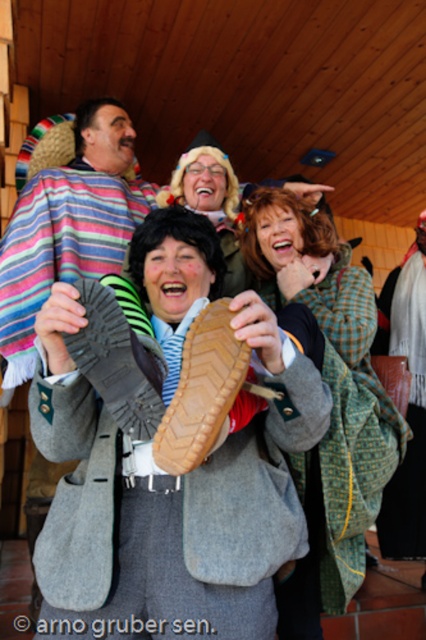
Does green plaid coat at center have a lesser width compared to rubber/textured shoe at center?

No, green plaid coat at center is not thinner than rubber/textured shoe at center.

Between point (386, 452) and point (83, 336), which one is positioned in front?

Point (83, 336) is in front.

At what (x,y) coordinates should I click in order to perform the action: click on green plaid coat at center. Please return your answer as a coordinate pair (x, y). The image size is (426, 640). Looking at the image, I should click on (333, 401).

Locate an element on the screen. Image resolution: width=426 pixels, height=640 pixels. green plaid coat at center is located at coordinates (333, 401).

Does brown leather shoe at center have a larger size compared to rubber/textured shoe at center?

Actually, brown leather shoe at center might be smaller than rubber/textured shoe at center.

Who is positioned more to the right, brown leather shoe at center or rubber/textured shoe at center?

Positioned to the right is brown leather shoe at center.

The height and width of the screenshot is (640, 426). Find the location of `brown leather shoe at center`. brown leather shoe at center is located at coordinates (201, 390).

The height and width of the screenshot is (640, 426). In order to click on brown leather shoe at center in this screenshot , I will do `click(201, 390)`.

Is green plaid coat at center below brown leather shoe at center?

Yes, green plaid coat at center is below brown leather shoe at center.

Which is behind, point (330, 276) or point (207, 349)?

The point (330, 276) is behind.

Does point (268, 209) come farther from viewer compared to point (213, 305)?

Yes, it is.

You are a GUI agent. You are given a task and a screenshot of the screen. Output one action in this format:
    pyautogui.click(x=<x>, y=<y>)
    Task: Click on the green plaid coat at center
    
    Given the screenshot: What is the action you would take?
    pyautogui.click(x=333, y=401)